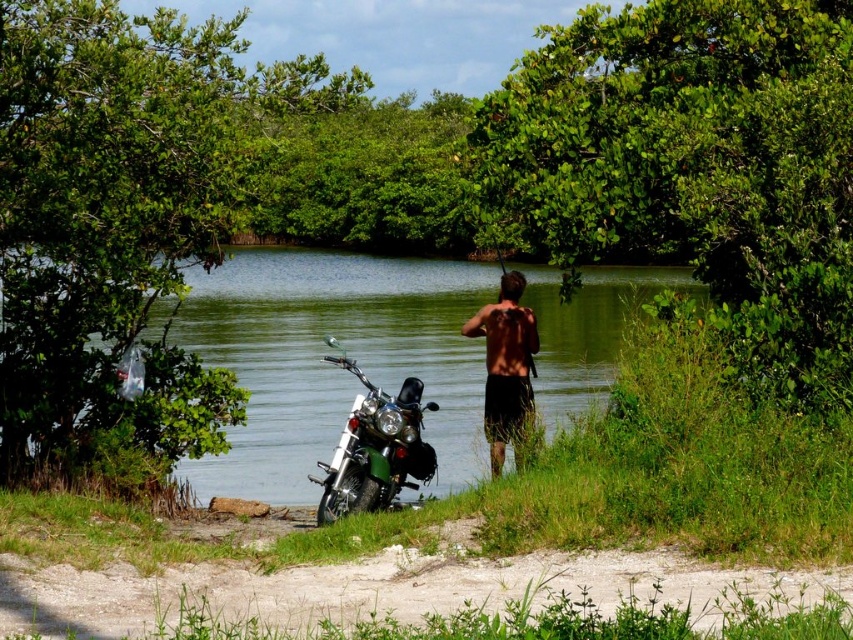
Can you confirm if green leafy tree at upper center is wider than green metallic motorcycle at lower left?

Yes, green leafy tree at upper center is wider than green metallic motorcycle at lower left.

Measure the distance from green leafy tree at upper center to green metallic motorcycle at lower left.

green leafy tree at upper center is 10.14 feet from green metallic motorcycle at lower left.

Who is more distant from viewer, (590, 144) or (335, 451)?

Point (590, 144)

At what (x,y) coordinates should I click in order to perform the action: click on green leafy tree at upper center. Please return your answer as a coordinate pair (x, y). The height and width of the screenshot is (640, 853). Looking at the image, I should click on (693, 166).

Is green leafy tree at left bigger than green water at center?

No, green leafy tree at left is not bigger than green water at center.

Find the location of `green leafy tree at left`. green leafy tree at left is located at coordinates (123, 221).

Who is more distant from viewer, (358, 458) or (485, 317)?

Point (485, 317)

Find the location of a particular element. green metallic motorcycle at lower left is located at coordinates (375, 449).

Between point (363, 433) and point (537, 348), which one is positioned in front?

Point (363, 433)

The width and height of the screenshot is (853, 640). I want to click on green metallic motorcycle at lower left, so click(x=375, y=449).